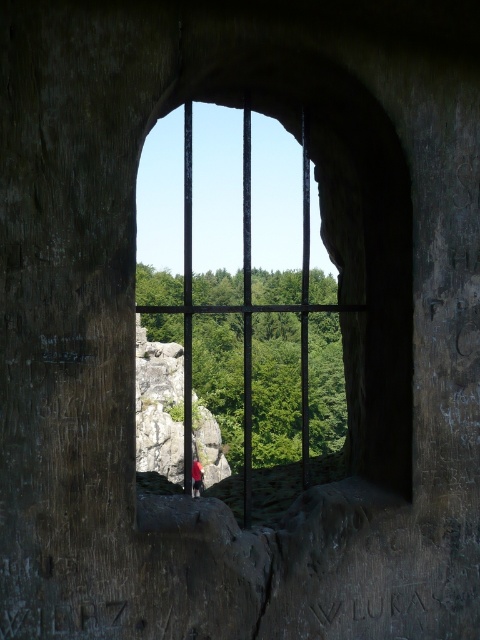
Does black metal bars at center lie in front of red fabric person at center?

Yes, it is.

Can you confirm if black metal bars at center is thinner than red fabric person at center?

In fact, black metal bars at center might be wider than red fabric person at center.

At what (x,y) coordinates should I click in order to perform the action: click on black metal bars at center. Please return your answer as a coordinate pair (x, y). Looking at the image, I should click on (243, 305).